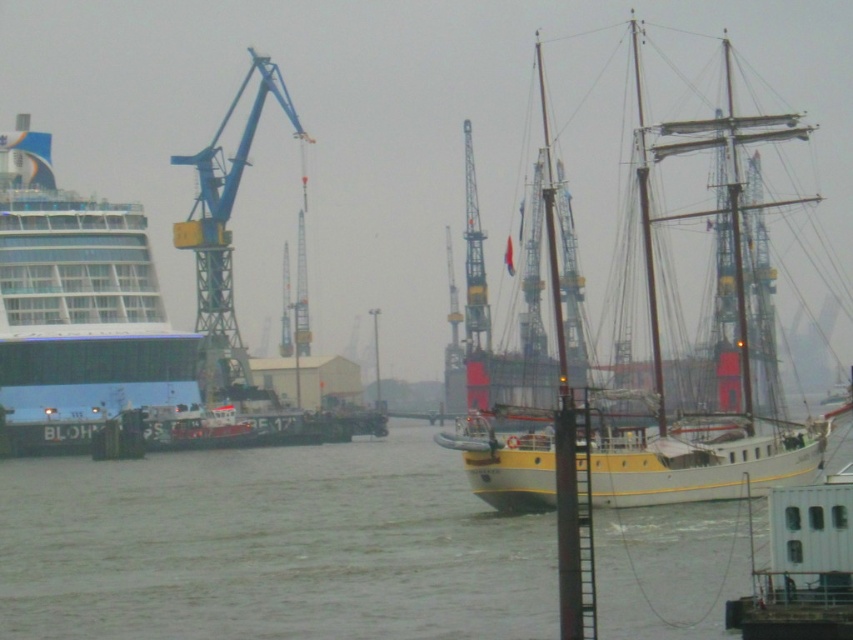
You are standing at the center of the harbor and want to locate the matte glass cruise ship at left. According to the coordinates provided, in which direction should you look to find it?

The matte glass cruise ship at left is located at coordinates point (76, 308), which means it is positioned to the left side of the scene. Therefore, you should look to your left to find it.

You are a harbor worker who needs to move the yellow polished wood sailboat at center and the blue metallic crane at left. Considering their sizes, which object would require more space to maneuver?

The yellow polished wood sailboat at center is bigger than the blue metallic crane at left, so it would require more space to maneuver.